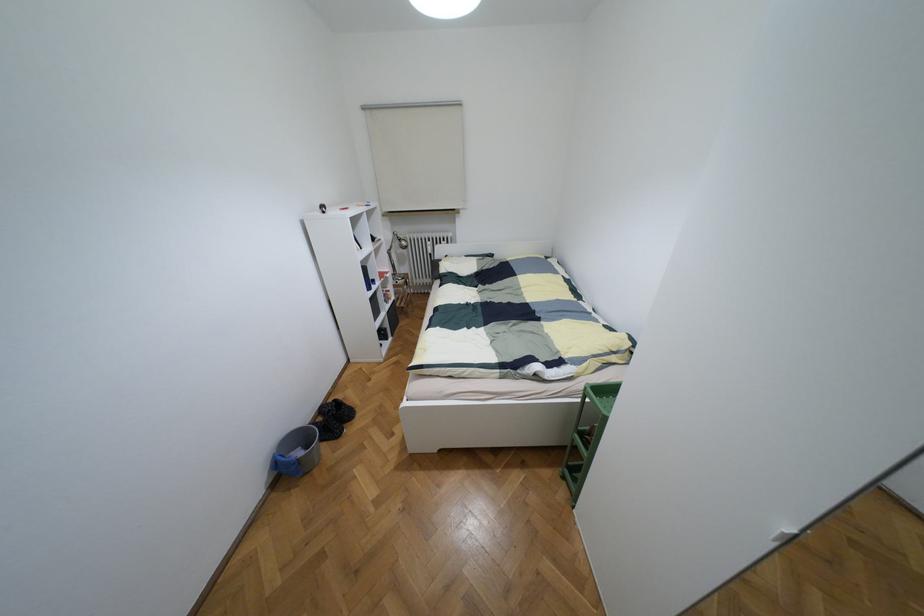
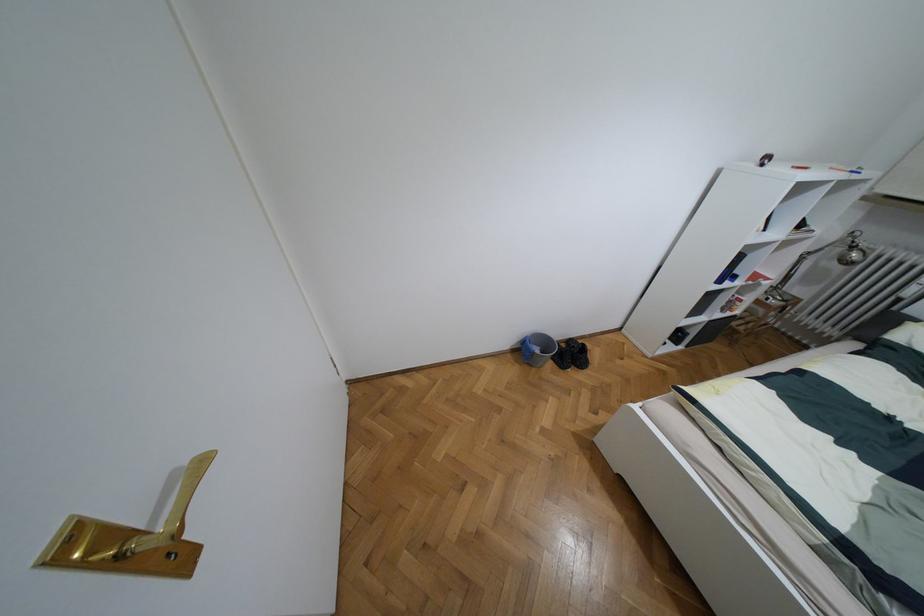
Find the pixel in the second image that matches point 398,238 in the first image.

(852, 246)